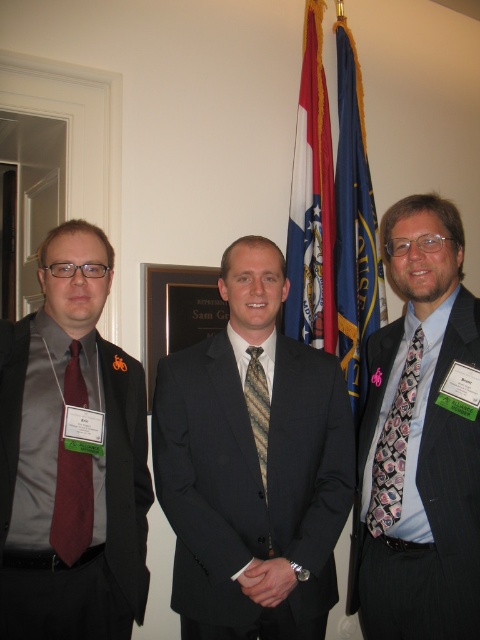
Question: Which of the following is the farthest from the observer?

Choices:
 (A) blue fabric flag at center
 (B) dark gray suit at center
 (C) matte black suit at left
 (D) blue fabric flag at upper center

Answer: (D)

Question: Considering the real-world distances, which object is closest to the wooden plaque at center?

Choices:
 (A) floral silk tie at right
 (B) patterned silk tie at center
 (C) blue fabric flag at upper center
 (D) matte black suit at left

Answer: (C)

Question: In this image, where is maroon satin tie at left located relative to striped silk tie at center?

Choices:
 (A) below
 (B) above

Answer: (A)

Question: Is blue fabric flag at center positioned at the back of striped silk tie at center?

Choices:
 (A) no
 (B) yes

Answer: (B)

Question: Does blue fabric flag at center have a lesser width compared to green fabric plaque at center?

Choices:
 (A) yes
 (B) no

Answer: (B)

Question: Among these points, which one is farthest from the camera?

Choices:
 (A) (320, 74)
 (B) (250, 515)

Answer: (A)